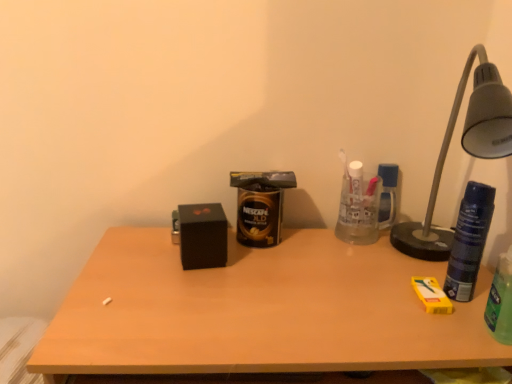
What are the coordinates of `free spot behind blue textured can at right, arranged as the 2th beverage when viewed from the left` in the screenshot? It's located at (409, 253).